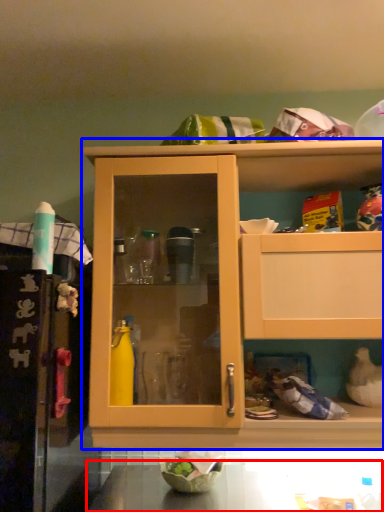
Question: Which point is further to the camera, counter top (highlighted by a red box) or cabinetry (highlighted by a blue box)?

Choices:
 (A) counter top
 (B) cabinetry

Answer: (B)